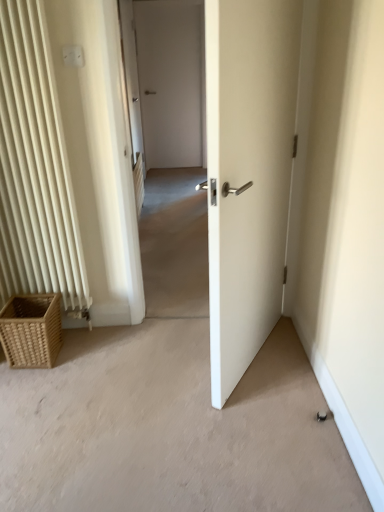
What are the coordinates of `woven brown picnic basket at lower left` in the screenshot? It's located at (31, 330).

What do you see at coordinates (31, 330) in the screenshot? The image size is (384, 512). I see `woven brown picnic basket at lower left` at bounding box center [31, 330].

In order to face white plastic electric outlet at upper left, should I rotate leftwards or rightwards?

It's best to rotate left around 15.816 degrees.

This screenshot has height=512, width=384. What do you see at coordinates (73, 56) in the screenshot?
I see `white plastic electric outlet at upper left` at bounding box center [73, 56].

What is the approximate height of white plastic electric outlet at upper left?

white plastic electric outlet at upper left is 8.83 centimeters in height.

Identify the location of white plastic electric outlet at upper left. This screenshot has width=384, height=512. (73, 56).

The height and width of the screenshot is (512, 384). What are the coordinates of `woven brown picnic basket at lower left` in the screenshot? It's located at (31, 330).

Considering the positions of objects woven brown picnic basket at lower left and white plastic electric outlet at upper left in the image provided, who is more to the right, woven brown picnic basket at lower left or white plastic electric outlet at upper left?

Positioned to the right is white plastic electric outlet at upper left.

Looking at this image, which is in front, woven brown picnic basket at lower left or white plastic electric outlet at upper left?

white plastic electric outlet at upper left is closer to the camera.

Is point (35, 313) positioned behind point (78, 56)?

Yes, it is.

From the image's perspective, would you say woven brown picnic basket at lower left is positioned over white plastic electric outlet at upper left?

Actually, woven brown picnic basket at lower left appears below white plastic electric outlet at upper left in the image.

From a real-world perspective, is woven brown picnic basket at lower left on top of white plastic electric outlet at upper left?

Incorrect, from a real-world perspective, woven brown picnic basket at lower left is lower than white plastic electric outlet at upper left.

Considering the sizes of objects woven brown picnic basket at lower left and white plastic electric outlet at upper left in the image provided, who is thinner, woven brown picnic basket at lower left or white plastic electric outlet at upper left?

white plastic electric outlet at upper left.

Considering the sizes of objects woven brown picnic basket at lower left and white plastic electric outlet at upper left in the image provided, who is taller, woven brown picnic basket at lower left or white plastic electric outlet at upper left?

With more height is woven brown picnic basket at lower left.

Considering the relative sizes of woven brown picnic basket at lower left and white plastic electric outlet at upper left in the image provided, is woven brown picnic basket at lower left bigger than white plastic electric outlet at upper left?

Indeed, woven brown picnic basket at lower left has a larger size compared to white plastic electric outlet at upper left.

Is woven brown picnic basket at lower left situated inside white plastic electric outlet at upper left or outside?

woven brown picnic basket at lower left is spatially situated outside white plastic electric outlet at upper left.

Are woven brown picnic basket at lower left and white plastic electric outlet at upper left located far from each other?

Yes, woven brown picnic basket at lower left and white plastic electric outlet at upper left are located far from each other.

Is woven brown picnic basket at lower left facing away from white plastic electric outlet at upper left?

woven brown picnic basket at lower left does not have its back to white plastic electric outlet at upper left.

Identify the location of electric outlet on the right of woven brown picnic basket at lower left. The width and height of the screenshot is (384, 512). (73, 56).

Does white plastic electric outlet at upper left appear on the left side of woven brown picnic basket at lower left?

Incorrect, white plastic electric outlet at upper left is not on the left side of woven brown picnic basket at lower left.

Is white plastic electric outlet at upper left positioned in front of woven brown picnic basket at lower left?

Yes, white plastic electric outlet at upper left is closer to the viewer.

Between point (75, 55) and point (42, 329), which one is positioned in front?

Point (75, 55)

From the image's perspective, is white plastic electric outlet at upper left over woven brown picnic basket at lower left?

Yes, from the image's perspective, white plastic electric outlet at upper left is over woven brown picnic basket at lower left.

From a real-world perspective, which is physically below, white plastic electric outlet at upper left or woven brown picnic basket at lower left?

woven brown picnic basket at lower left.

Which object is thinner, white plastic electric outlet at upper left or woven brown picnic basket at lower left?

Thinner between the two is white plastic electric outlet at upper left.

Is white plastic electric outlet at upper left taller than woven brown picnic basket at lower left?

Incorrect, the height of white plastic electric outlet at upper left is not larger of that of woven brown picnic basket at lower left.

Can you confirm if white plastic electric outlet at upper left is smaller than woven brown picnic basket at lower left?

Yes.

Is white plastic electric outlet at upper left not inside woven brown picnic basket at lower left?

That's correct, white plastic electric outlet at upper left is outside of woven brown picnic basket at lower left.

Is white plastic electric outlet at upper left not near woven brown picnic basket at lower left?

That's right, there is a large distance between white plastic electric outlet at upper left and woven brown picnic basket at lower left.

Is white plastic electric outlet at upper left aimed at woven brown picnic basket at lower left?

No.

How different are the orientations of white plastic electric outlet at upper left and woven brown picnic basket at lower left in degrees?

The angle between the facing direction of white plastic electric outlet at upper left and the facing direction of woven brown picnic basket at lower left is 1.1 degrees.

Locate an element on the screen. Image resolution: width=384 pixels, height=512 pixels. electric outlet to the right of woven brown picnic basket at lower left is located at coordinates (73, 56).

This screenshot has width=384, height=512. What are the coordinates of `picnic basket below the white plastic electric outlet at upper left (from a real-world perspective)` in the screenshot? It's located at (31, 330).

The height and width of the screenshot is (512, 384). I want to click on electric outlet on the right of woven brown picnic basket at lower left, so click(x=73, y=56).